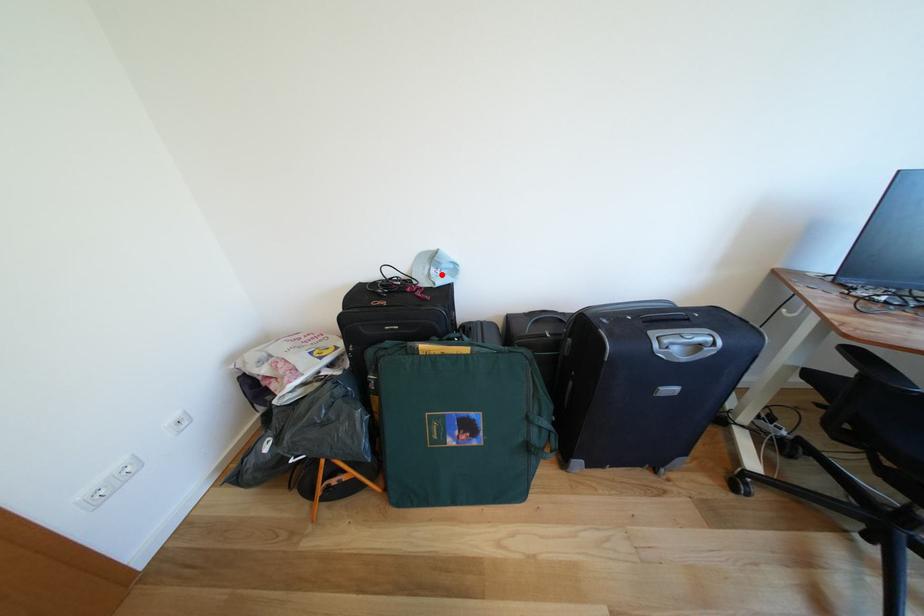
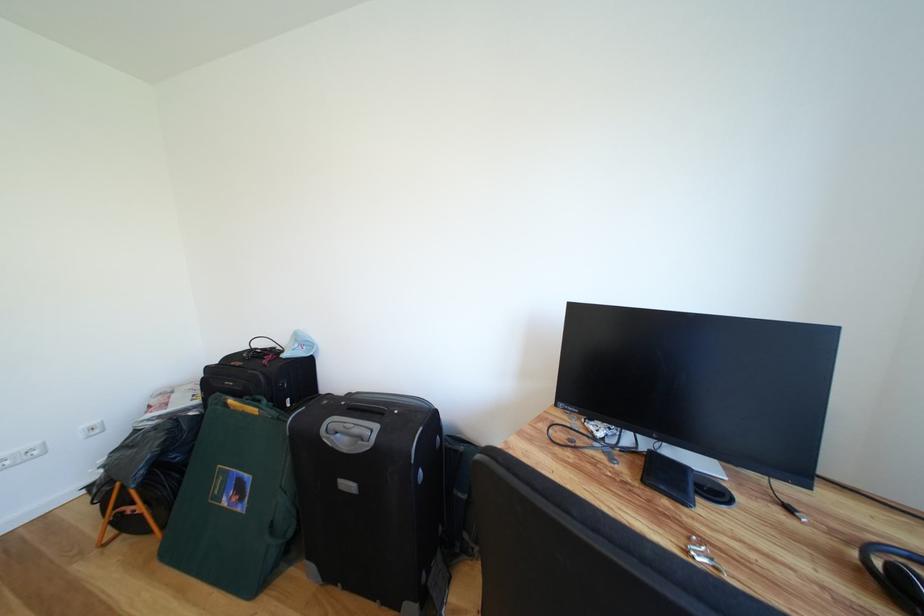
Find the pixel in the second image that matches the highlighted location in the first image.

(305, 350)